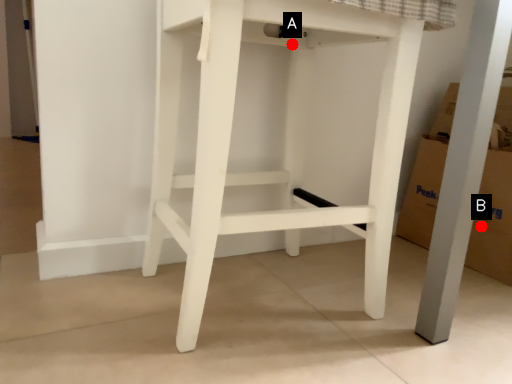
Question: Two points are circled on the image, labeled by A and B beside each circle. Which point appears closest to the camera in this image?

Choices:
 (A) A is closer
 (B) B is closer

Answer: (A)